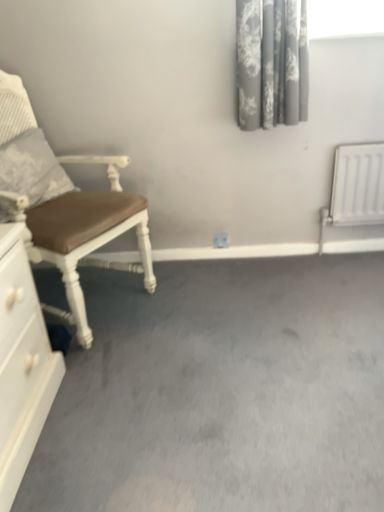
Where is `vacant area that is situated to the right of white glossy chest of drawers at lower left`? Image resolution: width=384 pixels, height=512 pixels. vacant area that is situated to the right of white glossy chest of drawers at lower left is located at coordinates (117, 422).